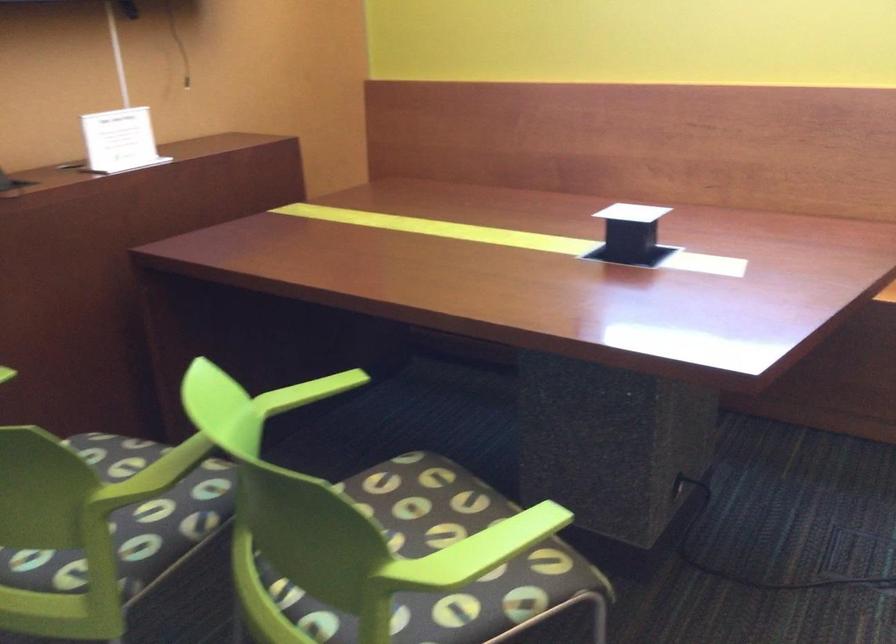
At what (x,y) coordinates should I click in order to perform the action: click on chair sitting surface. Please return your answer as a coordinate pair (x, y). Looking at the image, I should click on (403, 487).